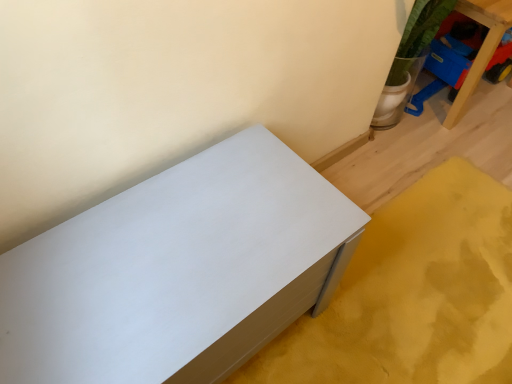
The image size is (512, 384). Identify the location of blue plastic toy at upper right, the first furniture positioned from the right. (481, 47).

How much space does blue plastic toy at upper right, marked as the second furniture in a bottom-to-top arrangement, occupy horizontally?

blue plastic toy at upper right, marked as the second furniture in a bottom-to-top arrangement, is 15.90 inches in width.

What do you see at coordinates (481, 47) in the screenshot?
I see `blue plastic toy at upper right, which is counted as the 1th furniture, starting from the top` at bounding box center [481, 47].

The height and width of the screenshot is (384, 512). Find the location of `white matte chest of drawers at lower left, which is the second furniture in top-to-bottom order`. white matte chest of drawers at lower left, which is the second furniture in top-to-bottom order is located at coordinates (178, 271).

What do you see at coordinates (178, 271) in the screenshot? The height and width of the screenshot is (384, 512). I see `white matte chest of drawers at lower left, the first furniture when ordered from front to back` at bounding box center [178, 271].

In order to face white matte chest of drawers at lower left, which is the 2th furniture from back to front, should I rotate leftwards or rightwards?

You should look left and rotate roughly 9.910 degrees.

You are a GUI agent. You are given a task and a screenshot of the screen. Output one action in this format:
    pyautogui.click(x=<x>, y=<y>)
    Task: Click on the blue plastic toy at upper right, which is counted as the 1th furniture, starting from the top
    The width and height of the screenshot is (512, 384).
    Given the screenshot: What is the action you would take?
    pyautogui.click(x=481, y=47)

Between blue plastic toy at upper right, which is counted as the 2th furniture, starting from the front, and white matte chest of drawers at lower left, which is the 2th furniture from back to front, which one appears on the right side from the viewer's perspective?

From the viewer's perspective, blue plastic toy at upper right, which is counted as the 2th furniture, starting from the front, appears more on the right side.

Who is more distant, blue plastic toy at upper right, marked as the second furniture in a bottom-to-top arrangement, or white matte chest of drawers at lower left, which is the 2th furniture from back to front?

blue plastic toy at upper right, marked as the second furniture in a bottom-to-top arrangement, is more distant.

Is point (465, 91) farther from viewer compared to point (201, 186)?

That is True.

From the image's perspective, which object appears higher, blue plastic toy at upper right, which is counted as the 1th furniture, starting from the top, or white matte chest of drawers at lower left, the 1th furniture positioned from the left?

blue plastic toy at upper right, which is counted as the 1th furniture, starting from the top, appears higher in the image.

From a real-world perspective, who is located higher, blue plastic toy at upper right, the second furniture viewed from the left, or white matte chest of drawers at lower left, the 2th furniture when ordered from right to left?

blue plastic toy at upper right, the second furniture viewed from the left, is physically above.

Is blue plastic toy at upper right, the second furniture viewed from the left, wider than white matte chest of drawers at lower left, which is the second furniture in top-to-bottom order?

In fact, blue plastic toy at upper right, the second furniture viewed from the left, might be narrower than white matte chest of drawers at lower left, which is the second furniture in top-to-bottom order.

Considering the sizes of objects blue plastic toy at upper right, which is counted as the 2th furniture, starting from the front, and white matte chest of drawers at lower left, the 2th furniture when ordered from right to left, in the image provided, who is shorter, blue plastic toy at upper right, which is counted as the 2th furniture, starting from the front, or white matte chest of drawers at lower left, the 2th furniture when ordered from right to left,?

white matte chest of drawers at lower left, the 2th furniture when ordered from right to left.

Can you confirm if blue plastic toy at upper right, which is counted as the 2th furniture, starting from the front, is bigger than white matte chest of drawers at lower left, acting as the 1th furniture starting from the bottom?

Incorrect, blue plastic toy at upper right, which is counted as the 2th furniture, starting from the front, is not larger than white matte chest of drawers at lower left, acting as the 1th furniture starting from the bottom.

Does blue plastic toy at upper right, the second furniture viewed from the left, contain white matte chest of drawers at lower left, the 1th furniture positioned from the left?

No.

Is blue plastic toy at upper right, the first furniture positioned from the right, far from white matte chest of drawers at lower left, acting as the 1th furniture starting from the bottom?

blue plastic toy at upper right, the first furniture positioned from the right, is positioned a significant distance from white matte chest of drawers at lower left, acting as the 1th furniture starting from the bottom.

Could you tell me if blue plastic toy at upper right, marked as the first furniture in a back-to-front arrangement, is turned towards white matte chest of drawers at lower left, the 1th furniture positioned from the left?

No, blue plastic toy at upper right, marked as the first furniture in a back-to-front arrangement, is not oriented towards white matte chest of drawers at lower left, the 1th furniture positioned from the left.

What's the angular difference between blue plastic toy at upper right, the second furniture viewed from the left, and white matte chest of drawers at lower left, the 1th furniture positioned from the left,'s facing directions?

The angle between the facing direction of blue plastic toy at upper right, the second furniture viewed from the left, and the facing direction of white matte chest of drawers at lower left, the 1th furniture positioned from the left, is 1.2 degrees.

Measure the distance between blue plastic toy at upper right, which is counted as the 1th furniture, starting from the top, and white matte chest of drawers at lower left, which is the second furniture in top-to-bottom order.

blue plastic toy at upper right, which is counted as the 1th furniture, starting from the top, is 4.09 feet from white matte chest of drawers at lower left, which is the second furniture in top-to-bottom order.

Where is `furniture that is in front of the blue plastic toy at upper right, marked as the first furniture in a back-to-front arrangement`? furniture that is in front of the blue plastic toy at upper right, marked as the first furniture in a back-to-front arrangement is located at coordinates (178, 271).

Which is more to the right, white matte chest of drawers at lower left, the 2th furniture when ordered from right to left, or blue plastic toy at upper right, which is counted as the 2th furniture, starting from the front?

blue plastic toy at upper right, which is counted as the 2th furniture, starting from the front, is more to the right.

Consider the image. Is white matte chest of drawers at lower left, which is the 2th furniture from back to front, further to the viewer compared to blue plastic toy at upper right, which is counted as the 2th furniture, starting from the front?

No, the depth of white matte chest of drawers at lower left, which is the 2th furniture from back to front, is less than that of blue plastic toy at upper right, which is counted as the 2th furniture, starting from the front.

Is point (289, 164) positioned behind point (460, 84)?

No, it is in front of (460, 84).

From the image's perspective, between white matte chest of drawers at lower left, the 2th furniture when ordered from right to left, and blue plastic toy at upper right, marked as the first furniture in a back-to-front arrangement, who is located below?

white matte chest of drawers at lower left, the 2th furniture when ordered from right to left, is shown below in the image.

From a real-world perspective, is white matte chest of drawers at lower left, which is the 2th furniture from back to front, positioned over blue plastic toy at upper right, the first furniture positioned from the right, based on gravity?

Incorrect, from a real-world perspective, white matte chest of drawers at lower left, which is the 2th furniture from back to front, is lower than blue plastic toy at upper right, the first furniture positioned from the right.

Between white matte chest of drawers at lower left, acting as the 1th furniture starting from the bottom, and blue plastic toy at upper right, the first furniture positioned from the right, which one has larger width?

white matte chest of drawers at lower left, acting as the 1th furniture starting from the bottom, is wider.

Consider the image. Is white matte chest of drawers at lower left, the 2th furniture when ordered from right to left, taller than blue plastic toy at upper right, marked as the second furniture in a bottom-to-top arrangement?

No.

Is white matte chest of drawers at lower left, the 1th furniture positioned from the left, bigger or smaller than blue plastic toy at upper right, the second furniture viewed from the left?

Clearly, white matte chest of drawers at lower left, the 1th furniture positioned from the left, is larger in size than blue plastic toy at upper right, the second furniture viewed from the left.

Is white matte chest of drawers at lower left, which is the second furniture in top-to-bottom order, inside the boundaries of blue plastic toy at upper right, marked as the second furniture in a bottom-to-top arrangement, or outside?

white matte chest of drawers at lower left, which is the second furniture in top-to-bottom order, cannot be found inside blue plastic toy at upper right, marked as the second furniture in a bottom-to-top arrangement.

Is white matte chest of drawers at lower left, which is the 2th furniture from back to front, positioned far away from blue plastic toy at upper right, which is counted as the 2th furniture, starting from the front?

Yes.

Is white matte chest of drawers at lower left, acting as the 1th furniture starting from the bottom, aimed at blue plastic toy at upper right, which is counted as the 2th furniture, starting from the front?

No, white matte chest of drawers at lower left, acting as the 1th furniture starting from the bottom, is not facing towards blue plastic toy at upper right, which is counted as the 2th furniture, starting from the front.

Can you tell me how much white matte chest of drawers at lower left, the first furniture when ordered from front to back, and blue plastic toy at upper right, marked as the first furniture in a back-to-front arrangement, differ in facing direction?

1.2 degrees.

Where is `furniture that appears on the right of white matte chest of drawers at lower left, acting as the 1th furniture starting from the bottom`? This screenshot has height=384, width=512. furniture that appears on the right of white matte chest of drawers at lower left, acting as the 1th furniture starting from the bottom is located at coordinates (481, 47).

Image resolution: width=512 pixels, height=384 pixels. In order to click on furniture on the left side of blue plastic toy at upper right, marked as the second furniture in a bottom-to-top arrangement in this screenshot , I will do `click(178, 271)`.

Identify the location of furniture above the white matte chest of drawers at lower left, the first furniture when ordered from front to back (from a real-world perspective). (481, 47).